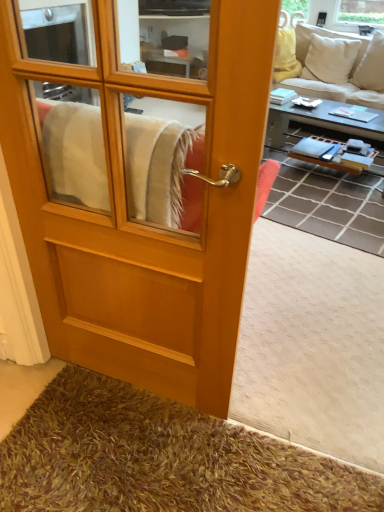
Question: Does beige fabric couch at upper right have a larger size compared to brown shaggy carpet at center?

Choices:
 (A) yes
 (B) no

Answer: (A)

Question: Is beige fabric couch at upper right smaller than brown shaggy carpet at center?

Choices:
 (A) yes
 (B) no

Answer: (B)

Question: Is beige fabric couch at upper right oriented away from brown shaggy carpet at center?

Choices:
 (A) no
 (B) yes

Answer: (A)

Question: Considering the relative positions of beige fabric couch at upper right and brown shaggy carpet at center in the image provided, is beige fabric couch at upper right to the right of brown shaggy carpet at center from the viewer's perspective?

Choices:
 (A) no
 (B) yes

Answer: (B)

Question: Is beige fabric couch at upper right closer to camera compared to brown shaggy carpet at center?

Choices:
 (A) yes
 (B) no

Answer: (B)

Question: Is point (336, 60) closer or farther from the camera than point (279, 112)?

Choices:
 (A) closer
 (B) farther

Answer: (B)

Question: Choose the correct answer: Is beige fabric couch at upper right inside wooden/textured coffee table at right or outside it?

Choices:
 (A) outside
 (B) inside

Answer: (A)

Question: Relative to wooden/textured coffee table at right, is beige fabric couch at upper right in front or behind?

Choices:
 (A) front
 (B) behind

Answer: (B)

Question: Based on their positions, is beige fabric couch at upper right located to the left or right of wooden/textured coffee table at right?

Choices:
 (A) left
 (B) right

Answer: (B)

Question: In terms of height, does brown shaggy carpet at center look taller or shorter compared to wooden door at center?

Choices:
 (A) short
 (B) tall

Answer: (A)

Question: From a real-world perspective, is brown shaggy carpet at center above or below wooden door at center?

Choices:
 (A) below
 (B) above

Answer: (A)

Question: From the image's perspective, is brown shaggy carpet at center above or below wooden door at center?

Choices:
 (A) below
 (B) above

Answer: (B)

Question: Considering the positions of brown shaggy carpet at center and wooden door at center in the image, is brown shaggy carpet at center bigger or smaller than wooden door at center?

Choices:
 (A) small
 (B) big

Answer: (B)

Question: Does point (112, 80) appear closer or farther from the camera than point (264, 353)?

Choices:
 (A) closer
 (B) farther

Answer: (A)

Question: Considering the positions of wooden door at center and brown shaggy carpet at center in the image, is wooden door at center taller or shorter than brown shaggy carpet at center?

Choices:
 (A) tall
 (B) short

Answer: (A)